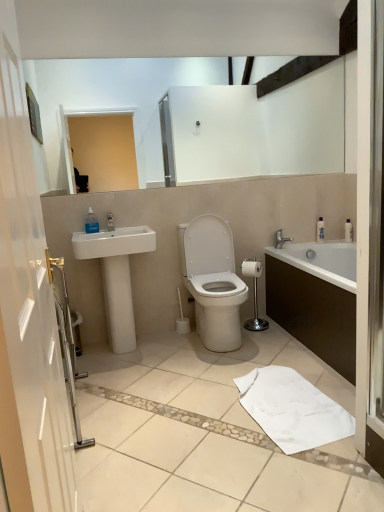
Question: Is clear plastic soap dispenser at upper left wider or thinner than white glossy bathtub at right?

Choices:
 (A) wide
 (B) thin

Answer: (B)

Question: Considering their positions, is clear plastic soap dispenser at upper left located in front of or behind white glossy bathtub at right?

Choices:
 (A) front
 (B) behind

Answer: (B)

Question: Which of these objects is positioned farthest from the clear plastic soap dispenser at upper left?

Choices:
 (A) white cotton bath towel at lower center
 (B) white glossy bathtub at right
 (C) chrome metallic toilet paper holder at center
 (D) silver metallic faucet at upper right
 (E) white glossy toilet at center

Answer: (A)

Question: Which is farther from the white glossy bathtub at right?

Choices:
 (A) transparent glass screen door at right
 (B) silver metallic faucet at upper right
 (C) clear plastic soap dispenser at upper left
 (D) white glossy toilet at center
 (E) white glossy sink at left

Answer: (C)